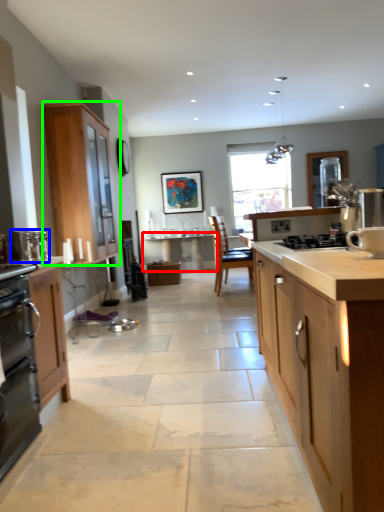
Question: Which object is the farthest from table (highlighted by a red box)? Choose among these: appliance (highlighted by a blue box) or cabinetry (highlighted by a green box).

Choices:
 (A) appliance
 (B) cabinetry

Answer: (A)